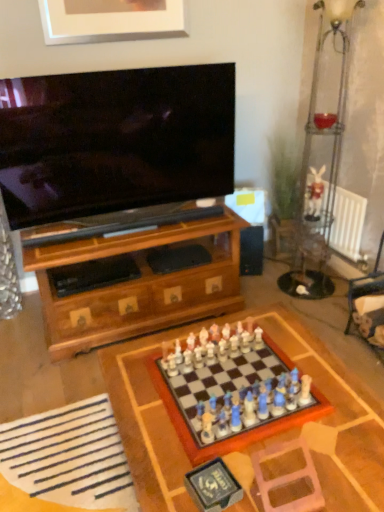
At what (x,y) coordinates should I click in order to perform the action: click on vacant region above wooden chessboard at center (from a real-world perspective). Please return your answer as a coordinate pair (x, y). Image resolution: width=384 pixels, height=512 pixels. Looking at the image, I should click on (249, 414).